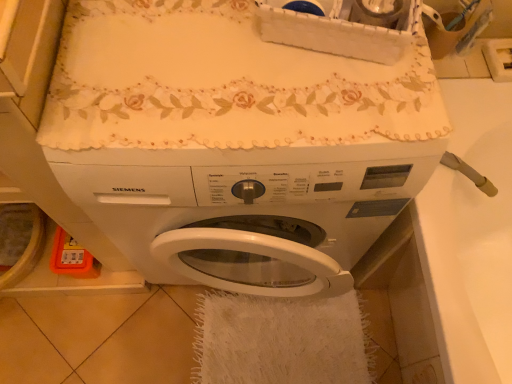
The image size is (512, 384). I want to click on blank space situated above white matte washing machine at center (from a real-world perspective), so click(x=228, y=79).